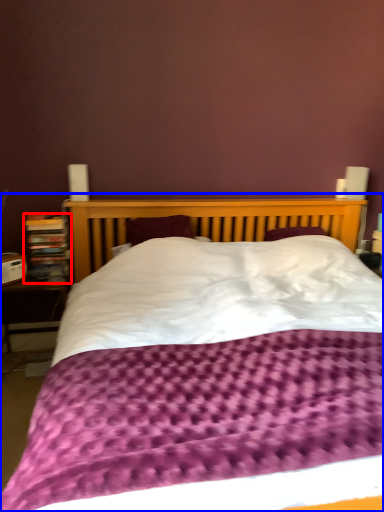
Question: Which object appears farthest to the camera in this image, bookcase (highlighted by a red box) or bed (highlighted by a blue box)?

Choices:
 (A) bookcase
 (B) bed

Answer: (A)